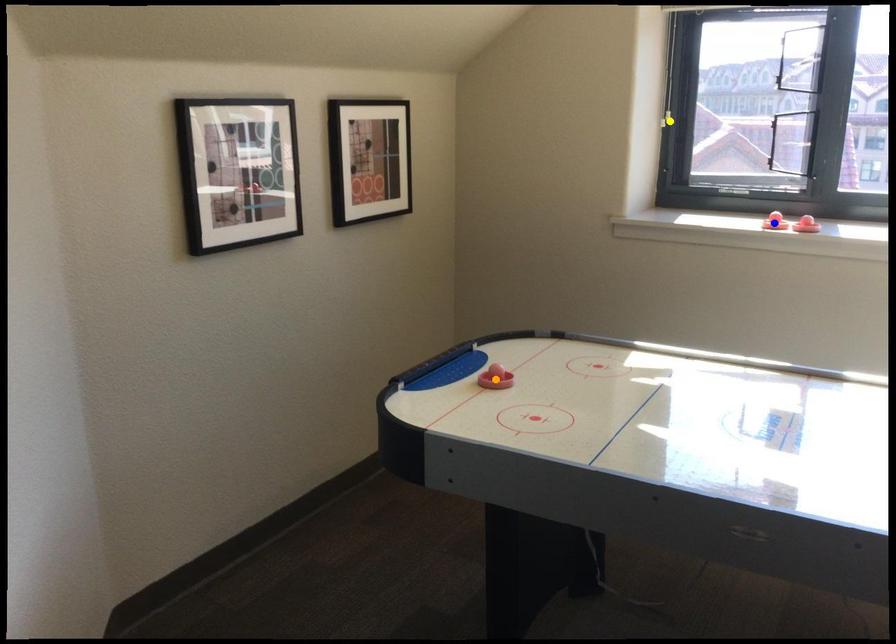
Order these from nearest to farthest:
yellow point, blue point, orange point

1. orange point
2. blue point
3. yellow point